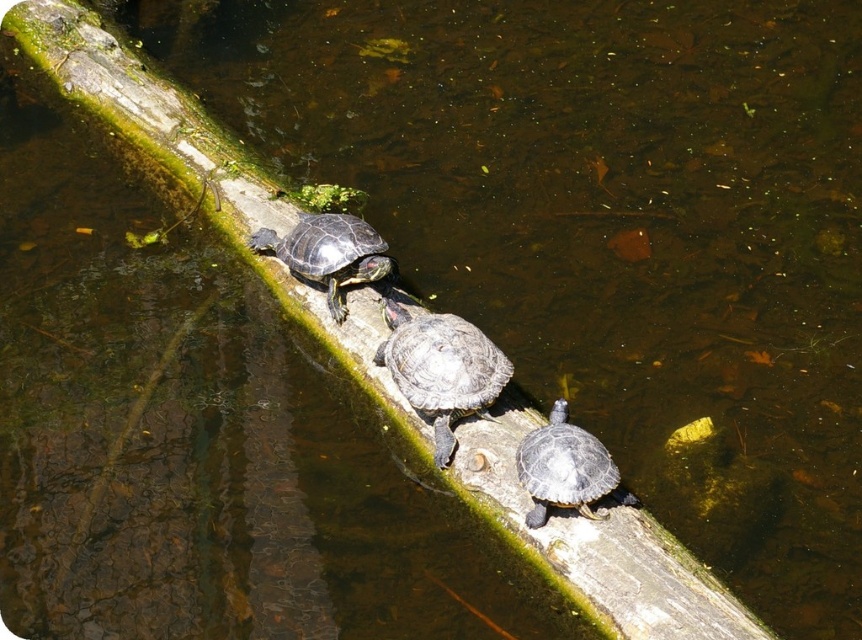
You are a wildlife photographer aiming to capture a clear photo of the smooth gray tortoise at center and the shiny dark green tortoise at center. Since the water is murky, you decide to focus on the log. Which tortoise is positioned higher on the log?

The smooth gray tortoise at center is located above the shiny dark green tortoise at center on the log.

You are a wildlife photographer aiming to capture a closeup of the shiny dark green tortoise at center and the shiny dark green tortoise at upper center. Since you need to adjust your camera focus based on their height, which tortoise should you focus on first if you want to start with the shorter one?

The shiny dark green tortoise at center has a lesser height compared to the shiny dark green tortoise at upper center, so you should focus on the shiny dark green tortoise at center first.

You are a wildlife researcher observing the turtles on the log. You need to determine which tortoise has a bigger size between the smooth gray tortoise at center and the shiny dark green tortoise at upper center. Based on the scene, which one is larger?

The smooth gray tortoise at center is larger in size than the shiny dark green tortoise at upper center.